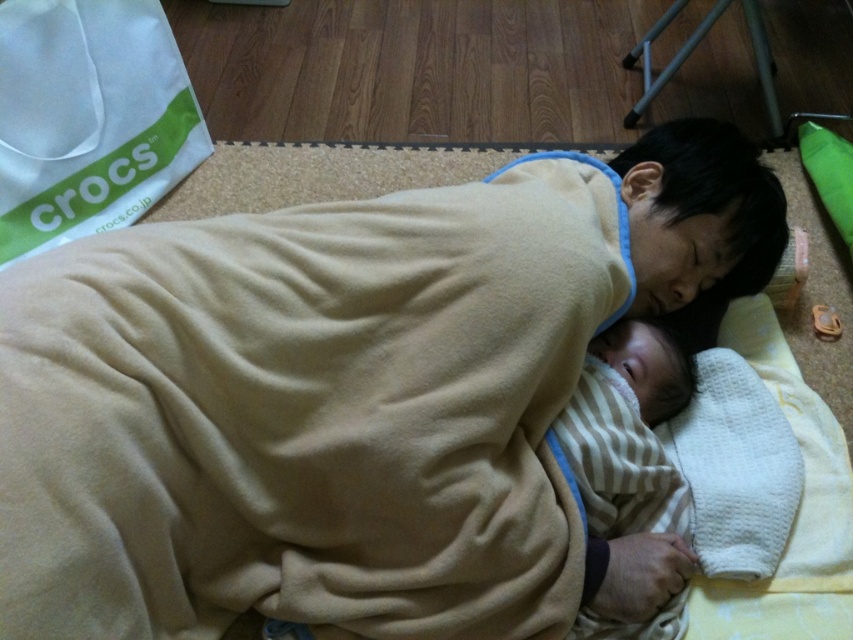
Question: Which of the following is the farthest from the observer?

Choices:
 (A) pos(699,353)
 (B) pos(614,624)

Answer: (A)

Question: Is striped fabric baby at center to the left of white textured cloth at lower center from the viewer's perspective?

Choices:
 (A) yes
 (B) no

Answer: (A)

Question: Which point appears farthest from the camera in this image?

Choices:
 (A) (590, 461)
 (B) (714, 524)

Answer: (B)

Question: Can you confirm if striped fabric baby at center is thinner than white textured cloth at lower center?

Choices:
 (A) yes
 (B) no

Answer: (B)

Question: Does striped fabric baby at center appear over white textured cloth at lower center?

Choices:
 (A) no
 (B) yes

Answer: (A)

Question: Among these objects, which one is farthest from the camera?

Choices:
 (A) striped fabric baby at center
 (B) white textured cloth at lower center

Answer: (B)